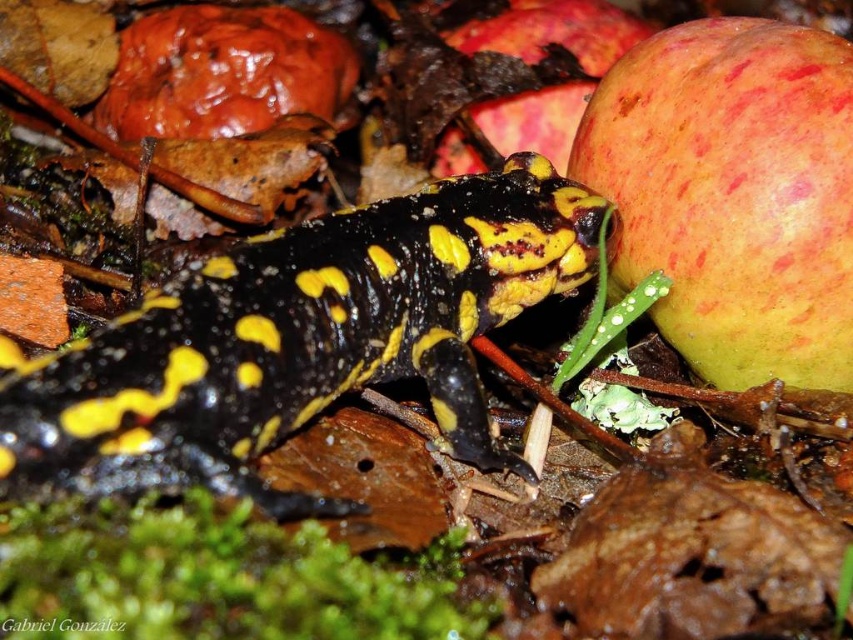
Can you confirm if speckled red apple at right is positioned above ripe red apple at upper right?

No, speckled red apple at right is not above ripe red apple at upper right.

Does speckled red apple at right have a greater height compared to ripe red apple at upper right?

Correct, speckled red apple at right is much taller as ripe red apple at upper right.

Find the location of a particular element. The height and width of the screenshot is (640, 853). speckled red apple at right is located at coordinates (733, 195).

I want to click on speckled red apple at right, so [x=733, y=195].